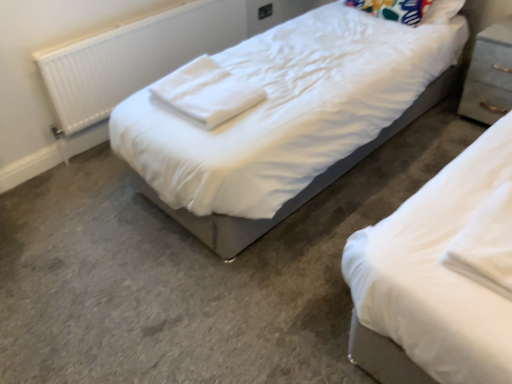
Question: Does light gray wood nightstand at right lie behind multicolored fabric pillow at upper right?

Choices:
 (A) yes
 (B) no

Answer: (B)

Question: Does light gray wood nightstand at right have a lesser width compared to multicolored fabric pillow at upper right?

Choices:
 (A) no
 (B) yes

Answer: (A)

Question: Is multicolored fabric pillow at upper right at the back of light gray wood nightstand at right?

Choices:
 (A) yes
 (B) no

Answer: (B)

Question: Is light gray wood nightstand at right positioned before multicolored fabric pillow at upper right?

Choices:
 (A) yes
 (B) no

Answer: (A)

Question: Considering the relative positions of light gray wood nightstand at right and multicolored fabric pillow at upper right in the image provided, is light gray wood nightstand at right to the left of multicolored fabric pillow at upper right from the viewer's perspective?

Choices:
 (A) yes
 (B) no

Answer: (B)

Question: Is light gray wood nightstand at right located outside multicolored fabric pillow at upper right?

Choices:
 (A) yes
 (B) no

Answer: (A)

Question: Are light gray wood nightstand at right and white plastic radiator at left far apart?

Choices:
 (A) yes
 (B) no

Answer: (A)

Question: Can you confirm if light gray wood nightstand at right is wider than white plastic radiator at left?

Choices:
 (A) no
 (B) yes

Answer: (B)

Question: Is light gray wood nightstand at right surrounding white plastic radiator at left?

Choices:
 (A) yes
 (B) no

Answer: (B)

Question: From a real-world perspective, is light gray wood nightstand at right positioned over white plastic radiator at left based on gravity?

Choices:
 (A) yes
 (B) no

Answer: (B)

Question: Does light gray wood nightstand at right have a larger size compared to white plastic radiator at left?

Choices:
 (A) yes
 (B) no

Answer: (B)

Question: Is the position of light gray wood nightstand at right more distant than that of white plastic radiator at left?

Choices:
 (A) no
 (B) yes

Answer: (B)

Question: Are white cotton cloth at center and light gray wood nightstand at right making contact?

Choices:
 (A) yes
 (B) no

Answer: (B)